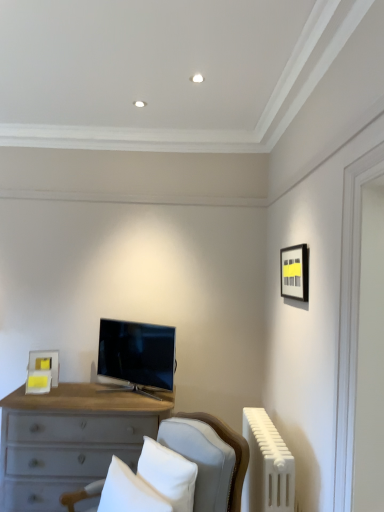
Question: In terms of height, does matte yellow picture frame at center, the second picture frame positioned from the front, look taller or shorter compared to satin black tv at center?

Choices:
 (A) short
 (B) tall

Answer: (A)

Question: From a real-world perspective, relative to satin black tv at center, is matte yellow picture frame at center, which appears as the 2th picture frame when viewed from the right, vertically above or below?

Choices:
 (A) above
 (B) below

Answer: (B)

Question: Which is farther from the white soft pillow at lower center, which is counted as the 1th pillow, starting from the left?

Choices:
 (A) white matte radiator at lower right
 (B) light gray wood desk at center
 (C) matte black picture frame at upper right, which is counted as the second picture frame, starting from the bottom
 (D) matte yellow picture frame at center, which is the first picture frame from left to right
 (E) white fabric pillow at center, the second pillow in the left-to-right sequence

Answer: (C)

Question: Which object is the closest to the matte black picture frame at upper right, the first picture frame from the top?

Choices:
 (A) white soft pillow at lower center, positioned as the 2th pillow in right-to-left order
 (B) light gray wood desk at center
 (C) satin black tv at center
 (D) white matte radiator at lower right
 (E) matte yellow picture frame at center, the second picture frame positioned from the front

Answer: (D)